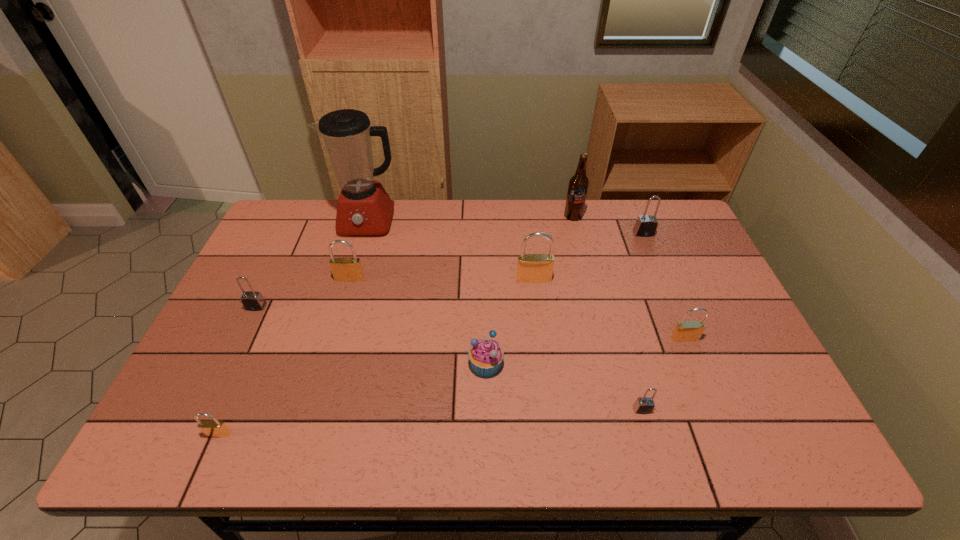
In order to click on blender in this screenshot , I will do `click(364, 208)`.

Where is `beer bottle`? The image size is (960, 540). beer bottle is located at coordinates (578, 185).

This screenshot has width=960, height=540. Identify the location of the tallest padlock. (531, 268).

Where is `the biggest brass padlock`? This screenshot has height=540, width=960. the biggest brass padlock is located at coordinates (531, 268).

In order to click on the farthest padlock in this screenshot , I will do `click(646, 225)`.

Identify the location of the rightmost gray padlock. The image size is (960, 540). (646, 225).

What are the coordinates of `the second brass padlock from left to right` in the screenshot? It's located at (346, 269).

At what (x,y) coordinates should I click in order to perform the action: click on the third padlock from left to right. Please return your answer as a coordinate pair (x, y). This screenshot has height=540, width=960. Looking at the image, I should click on (346, 269).

Identify the location of the fifth nearest object. (252, 300).

Identify the location of the second smallest gray padlock. (252, 300).